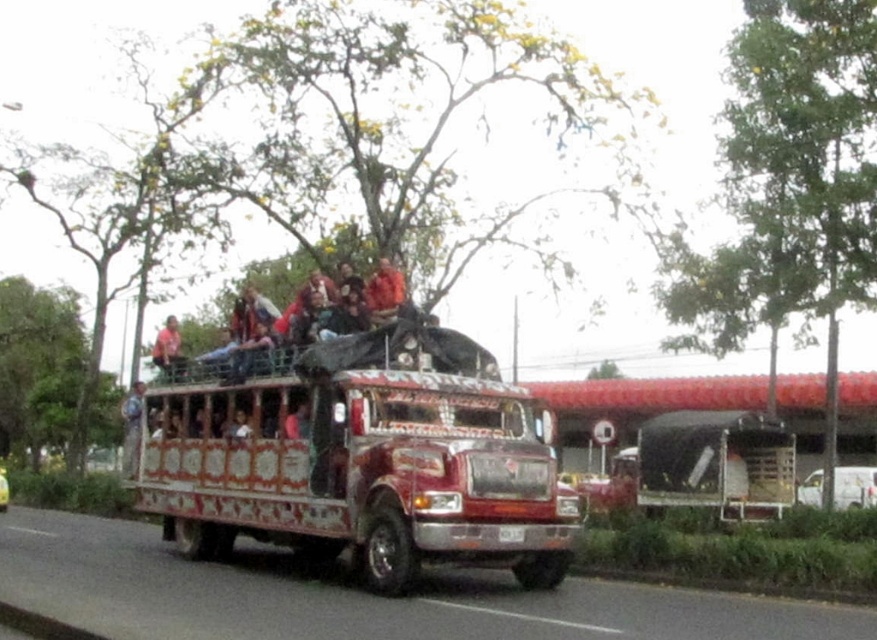
Question: Can you confirm if decorative painted bus at center is wider than matte pink shirt at center?

Choices:
 (A) yes
 (B) no

Answer: (B)

Question: Which of the following is the farthest from the observer?

Choices:
 (A) decorative painted bus at center
 (B) matte pink shirt at center

Answer: (B)

Question: Which object is farther from the camera taking this photo?

Choices:
 (A) decorative painted bus at center
 (B) matte pink shirt at center

Answer: (B)

Question: Is decorative painted bus at center above matte pink shirt at center?

Choices:
 (A) no
 (B) yes

Answer: (A)

Question: Is decorative painted bus at center bigger than matte pink shirt at center?

Choices:
 (A) yes
 (B) no

Answer: (B)

Question: Among these objects, which one is nearest to the camera?

Choices:
 (A) decorative painted bus at center
 (B) matte pink shirt at center

Answer: (A)